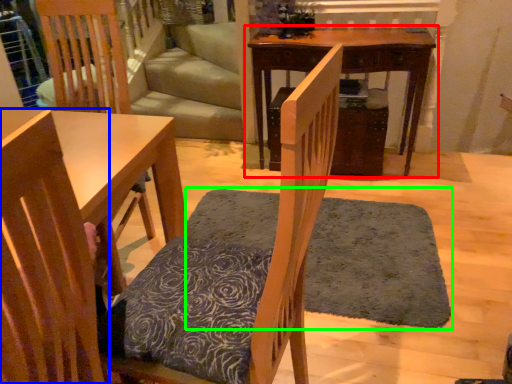
Question: Based on their relative distances, which object is nearer to table (highlighted by a red box)? Choose from chair (highlighted by a blue box) and doormat (highlighted by a green box).

Choices:
 (A) chair
 (B) doormat

Answer: (B)